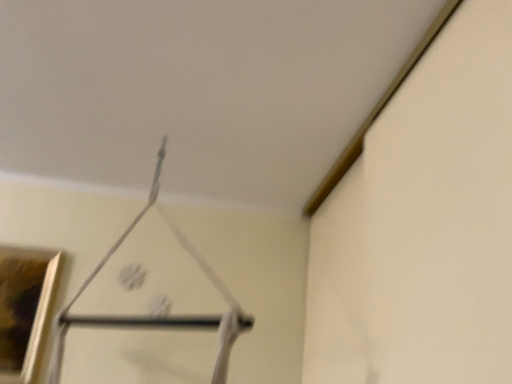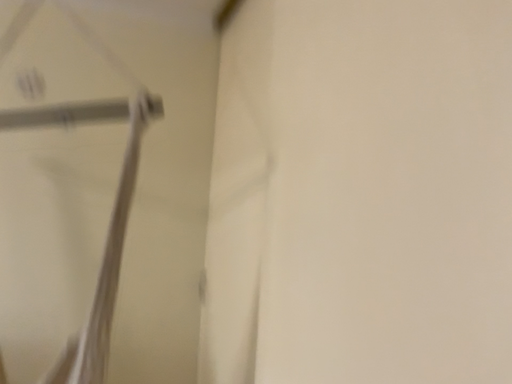
Question: Which way did the camera rotate in the video?

Choices:
 (A) rotated right
 (B) rotated left

Answer: (A)